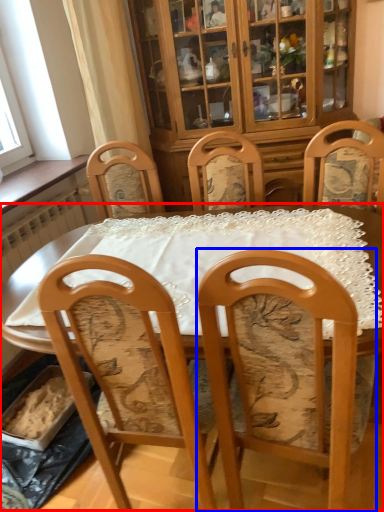
Question: Which of the following is the closest to the observer, table (highlighted by a red box) or chair (highlighted by a blue box)?

Choices:
 (A) table
 (B) chair

Answer: (B)